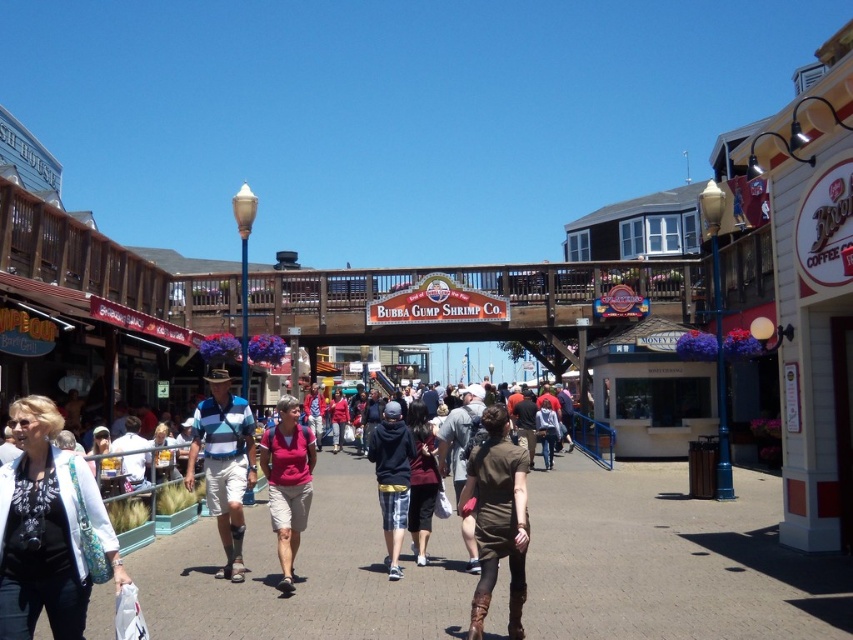
Question: Where is striped polo shirt at center located in relation to dark blue hoodie at center in the image?

Choices:
 (A) right
 (B) left

Answer: (B)

Question: Which of the following is the closest to the observer?

Choices:
 (A) dark blue hoodie at center
 (B) pink fabric shirt at center
 (C) striped polo shirt at center
 (D) white fabric jacket at lower left

Answer: (D)

Question: Is brown matte dress at center closer to the viewer compared to striped polo shirt at center?

Choices:
 (A) yes
 (B) no

Answer: (A)

Question: Is white fabric jacket at lower left smaller than pink fabric shirt at center?

Choices:
 (A) no
 (B) yes

Answer: (B)

Question: Which object appears farthest from the camera in this image?

Choices:
 (A) brown matte dress at center
 (B) dark blue hoodie at center
 (C) pink fabric shirt at center
 (D) striped polo shirt at center

Answer: (B)

Question: Which is nearer to the brown matte dress at center?

Choices:
 (A) white fabric jacket at lower left
 (B) striped polo shirt at center

Answer: (B)